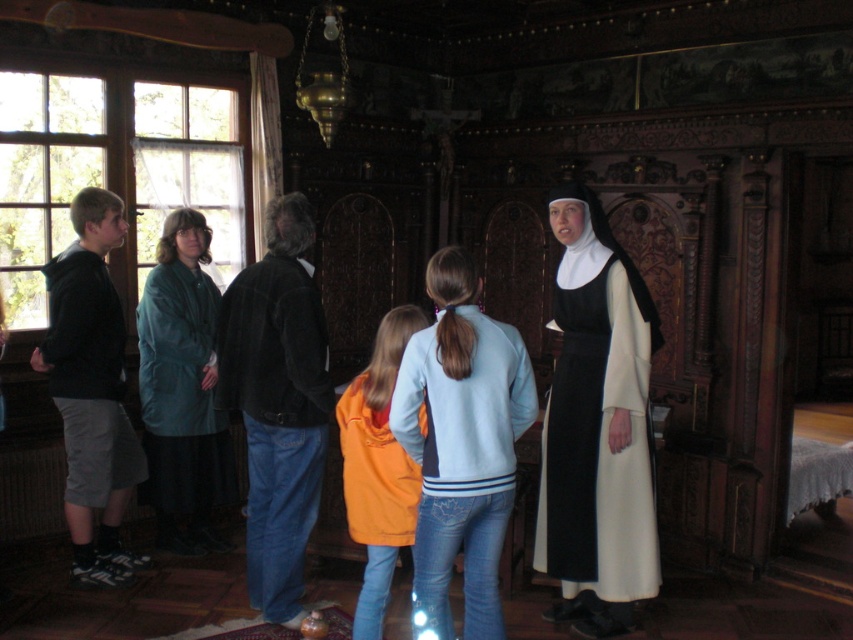
Is matte black hoodie at left closer to camera compared to white matte nun's habit at center?

No, it is not.

Between point (404, 396) and point (607, 522), which one is positioned behind?

Point (607, 522)

The width and height of the screenshot is (853, 640). In order to click on matte black hoodie at left in this screenshot , I will do `click(596, 426)`.

The image size is (853, 640). Find the location of `matte black hoodie at left`. matte black hoodie at left is located at coordinates (596, 426).

Can you confirm if white matte robe at center is taller than orange fleece jacket at center?

Incorrect, white matte robe at center's height is not larger of orange fleece jacket at center's.

Can you confirm if white matte robe at center is positioned below orange fleece jacket at center?

Actually, white matte robe at center is above orange fleece jacket at center.

Is point (485, 429) farther from viewer compared to point (349, 518)?

No, (485, 429) is in front of (349, 518).

At what (x,y) coordinates should I click in order to perform the action: click on white matte robe at center. Please return your answer as a coordinate pair (x, y). This screenshot has height=640, width=853. Looking at the image, I should click on (462, 467).

Who is positioned more to the right, white matte nun's habit at center or dark gray shorts at left?

Positioned to the right is white matte nun's habit at center.

Does white matte nun's habit at center have a lesser width compared to dark gray shorts at left?

No, white matte nun's habit at center is not thinner than dark gray shorts at left.

I want to click on white matte nun's habit at center, so click(x=596, y=428).